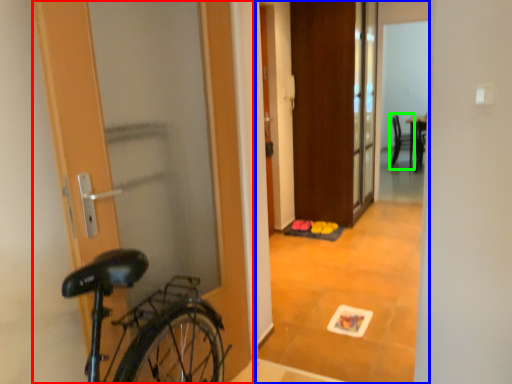
Question: Estimate the real-world distances between objects in this image. Which object is farther from door (highlighted by a red box), corridor (highlighted by a blue box) or chair (highlighted by a green box)?

Choices:
 (A) corridor
 (B) chair

Answer: (B)